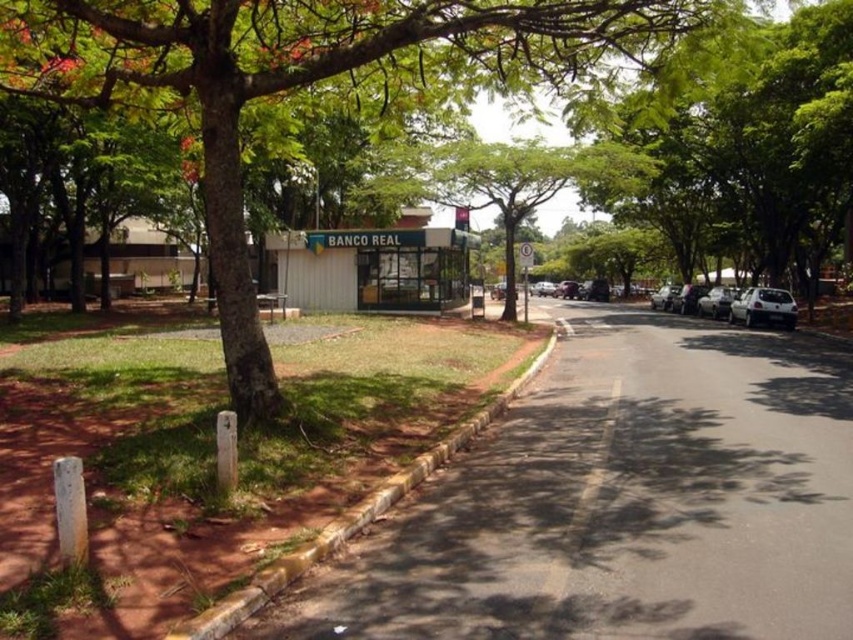
You are standing on the street looking at the tree and the Banco Real building. There are two points marked on the image. Which of the two points, point (131, 32) or point (780, 294), is closer to you?

Point (131, 32) is closer to the viewer than point (780, 294).

You are a pedestrian standing on the black asphalt road at center and want to cross the street to reach the white matte car at right. Is the road under the car a safe path to walk on?

The black asphalt road at center is positioned under white matte car at right, so yes, the road under the car is a safe path to walk on since it is part of the same road surface.

You are a pedestrian standing on the black asphalt road at center and want to cross to the white matte car at right. Is the road tall enough to block the car from view?

The black asphalt road at center is not as tall as white matte car at right, so the road is shorter than the car. Therefore, the road cannot block the car from view because it is not tall enough.